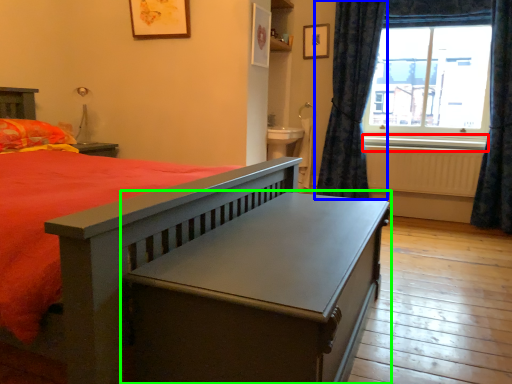
Question: Which is farther away from window sill (highlighted by a red box)? curtain (highlighted by a blue box) or table (highlighted by a green box)?

Choices:
 (A) curtain
 (B) table

Answer: (B)